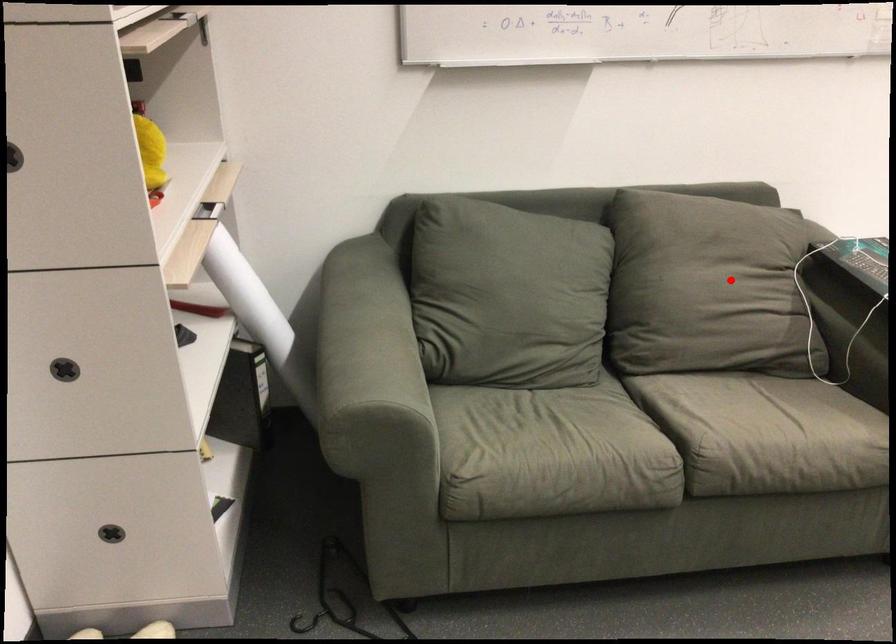
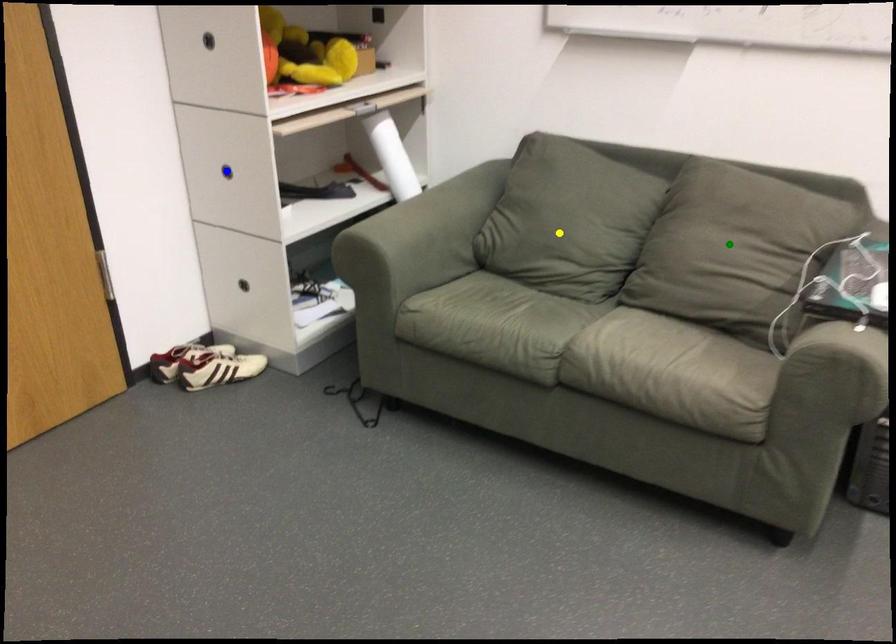
Question: I am providing you with two images of the same scene from different viewpoints. A red point is marked on the first image. You are given multiple points on the second image. Which point in image 2 is actually the same real-world point as the red point in image 1?

Choices:
 (A) blue point
 (B) yellow point
 (C) green point

Answer: (C)